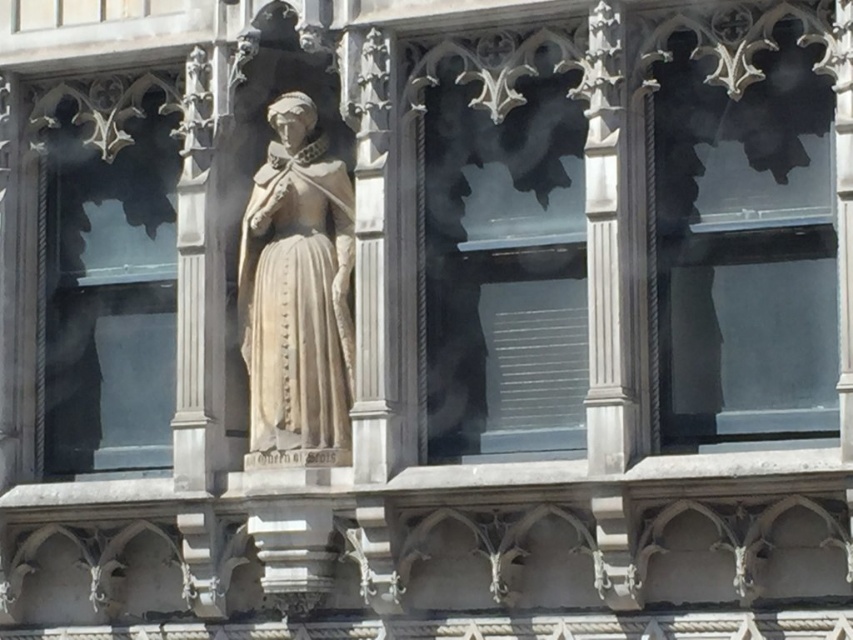
You are an architect analyzing the building facade. You need to locate the transparent glass window at left. Where is it positioned in terms of coordinates?

The transparent glass window at left is positioned at coordinates 0.445 in the x axis and 0.125 in the y axis.

You are an architect examining the building facade. You need to determine the position of the transparent glass window at upper center relative to the statue. Is it positioned above, below, to the left, or to the right of the statue?

The transparent glass window at upper center is located at point (744, 248), which places it above the statue since it is positioned at the upper center of the facade.